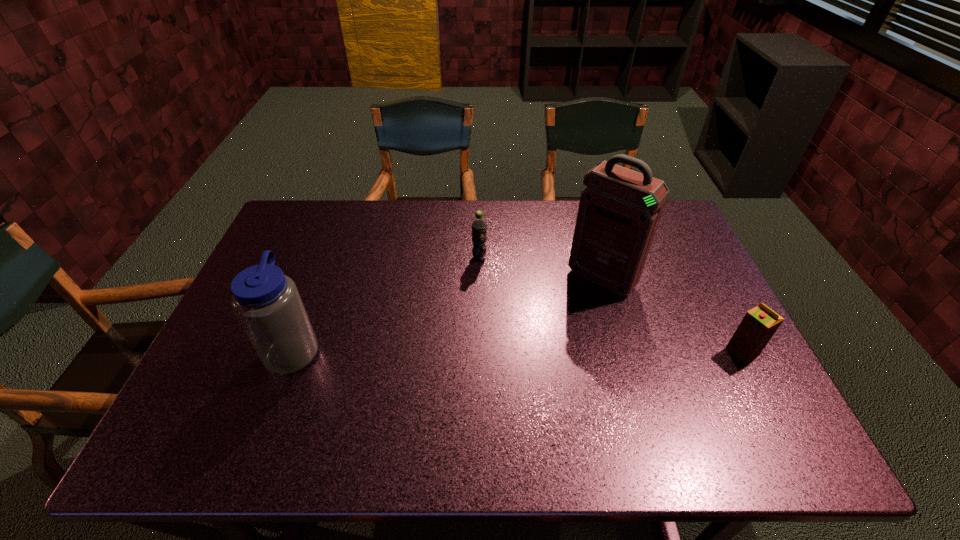
Locate an element on the screen. free space at the near left corner of the desktop is located at coordinates (237, 406).

Where is `free spot between the first-aid kit and the leftmost object`? free spot between the first-aid kit and the leftmost object is located at coordinates (447, 314).

This screenshot has height=540, width=960. I want to click on vacant point located between the tallest object and the second object from left to right, so click(x=540, y=268).

Identify the location of vacant area that lies between the third object from left to right and the rightmost object. This screenshot has height=540, width=960. (672, 315).

This screenshot has height=540, width=960. I want to click on free spot between the rightmost object and the water bottle, so click(518, 350).

Identify the location of vacant region between the water bottle and the orange juice. (518, 350).

The image size is (960, 540). Identify the location of unoccupied position between the orange juice and the leftmost object. (518, 350).

Locate an element on the screen. vacant region between the orange juice and the third object from right to left is located at coordinates (611, 305).

At what (x,y) coordinates should I click in order to perform the action: click on unoccupied position between the water bottle and the second object from right to left. Please return your answer as a coordinate pair (x, y). Looking at the image, I should click on (447, 314).

Identify the location of vacant space that's between the third object from right to left and the third shortest object. (387, 303).